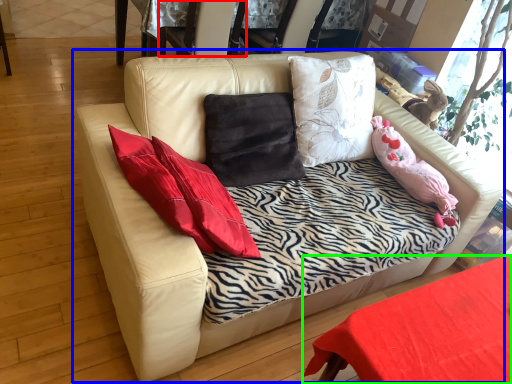
Question: Considering the real-world distances, which object is farthest from armchair (highlighted by a red box)? studio couch (highlighted by a blue box) or table (highlighted by a green box)?

Choices:
 (A) studio couch
 (B) table

Answer: (B)